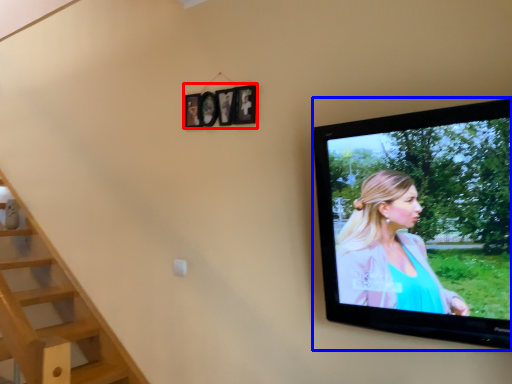
Question: Which of the following is the farthest to the observer, picture frame (highlighted by a red box) or television (highlighted by a blue box)?

Choices:
 (A) picture frame
 (B) television

Answer: (A)